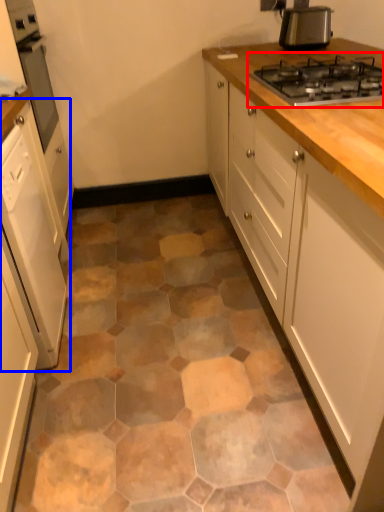
Question: Among these objects, which one is farthest to the camera, gas stove (highlighted by a red box) or cabinetry (highlighted by a blue box)?

Choices:
 (A) gas stove
 (B) cabinetry

Answer: (A)